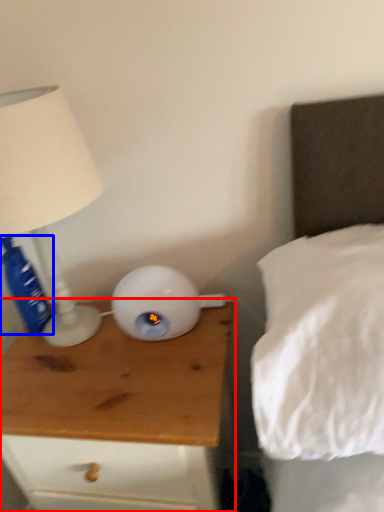
Question: Which of the following is the farthest to the observer, nightstand (highlighted by a red box) or bottle (highlighted by a blue box)?

Choices:
 (A) nightstand
 (B) bottle

Answer: (B)